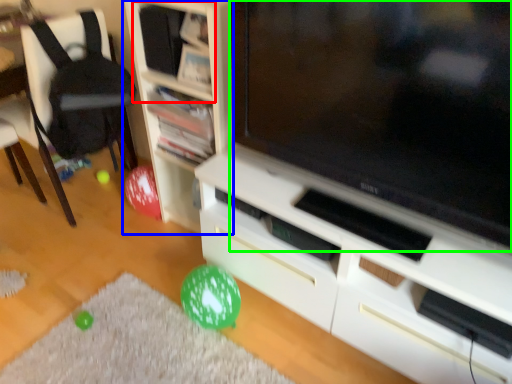
Question: Considering the real-world distances, which object is farthest from shelf (highlighted by a red box)? shelf (highlighted by a blue box) or television (highlighted by a green box)?

Choices:
 (A) shelf
 (B) television

Answer: (B)